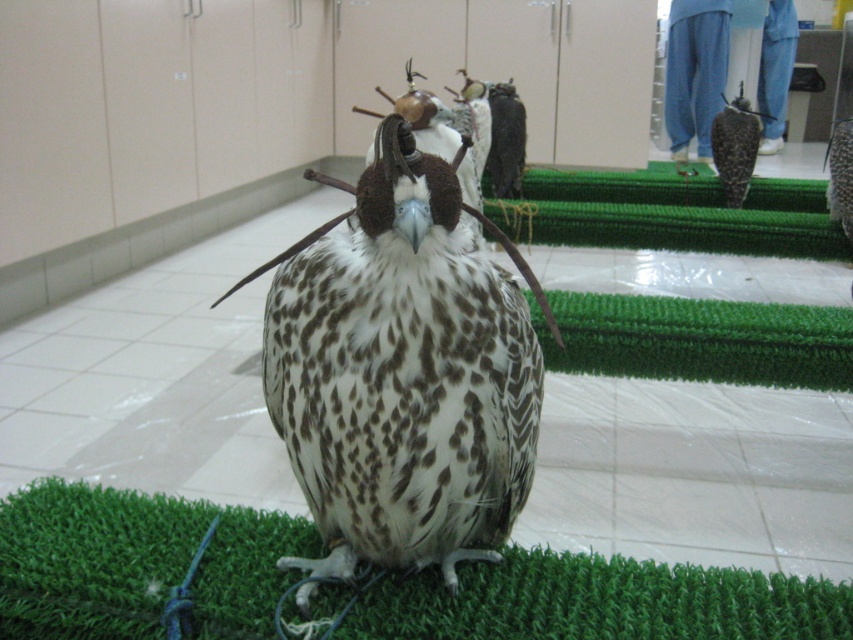
Question: Which object appears farthest from the camera in this image?

Choices:
 (A) brown speckled falcon at right
 (B) speckled feathered falcon at center
 (C) green artificial turf at center

Answer: (A)

Question: Which is farther from the brown speckled falcon at right?

Choices:
 (A) green artificial turf at center
 (B) speckled feathered falcon at center

Answer: (B)

Question: Does speckled feathered falcon at center appear on the right side of green artificial turf at center?

Choices:
 (A) yes
 (B) no

Answer: (A)

Question: Does speckled feathered falcon at center appear on the right side of green artificial turf at center?

Choices:
 (A) no
 (B) yes

Answer: (B)

Question: Which object appears closest to the camera in this image?

Choices:
 (A) green artificial turf at center
 (B) speckled feathered falcon at center

Answer: (B)

Question: Can you confirm if green artificial turf at center is positioned below brown speckled falcon at right?

Choices:
 (A) yes
 (B) no

Answer: (A)